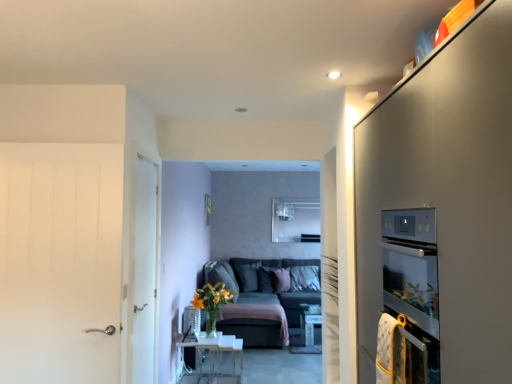
This screenshot has width=512, height=384. Find the location of `white wood door at left, marked as the first door in a back-to-front arrangement`. white wood door at left, marked as the first door in a back-to-front arrangement is located at coordinates (145, 271).

Describe the element at coordinates (259, 302) in the screenshot. This screenshot has height=384, width=512. I see `dark gray fabric couch at center` at that location.

The height and width of the screenshot is (384, 512). Describe the element at coordinates (281, 280) in the screenshot. I see `pink fabric pillow at center, the 2th pillow in the right-to-left sequence` at that location.

This screenshot has width=512, height=384. Describe the element at coordinates (248, 276) in the screenshot. I see `velvet dark gray pillow at center, which appears as the first pillow when viewed from the left` at that location.

Image resolution: width=512 pixels, height=384 pixels. What do you see at coordinates (60, 261) in the screenshot?
I see `white matte door at left, which is counted as the 2th door, starting from the back` at bounding box center [60, 261].

Measure the distance between point (480, 88) and camera.

They are 3.65 feet apart.

Find the location of a particular element. white wood door at left, marked as the first door in a back-to-front arrangement is located at coordinates (145, 271).

From the picture: From the image's perspective, which one is positioned lower, dark gray fabric couch at center or white wood door at left, marked as the first door in a back-to-front arrangement?

dark gray fabric couch at center is shown below in the image.

Image resolution: width=512 pixels, height=384 pixels. What are the coordinates of `the 1st door counting from the left side of the dark gray fabric couch at center` in the screenshot? It's located at (145, 271).

In the scene shown: Is dark gray fabric couch at center facing away from white wood door at left, the second door viewed from the front?

No.

From the image's perspective, is clear glass table at lower center above or below satin white cabinet at right?

clear glass table at lower center is situated lower than satin white cabinet at right in the image.

Is clear glass table at lower center aimed at satin white cabinet at right?

No, clear glass table at lower center is not turned towards satin white cabinet at right.

Considering the sizes of objects clear glass table at lower center and satin white cabinet at right in the image provided, who is bigger, clear glass table at lower center or satin white cabinet at right?

satin white cabinet at right is bigger.

How far apart are clear glass table at lower center and satin white cabinet at right?

clear glass table at lower center is 3.52 meters from satin white cabinet at right.

Can you confirm if white wood door at left, the first door from the right, is shorter than clear glass table at lower center?

No.

Can you confirm if white wood door at left, the second door viewed from the left, is smaller than clear glass table at lower center?

Yes, white wood door at left, the second door viewed from the left, is smaller than clear glass table at lower center.

Between white wood door at left, the second door viewed from the left, and clear glass table at lower center, which one is positioned behind?

clear glass table at lower center.

Is white wood door at left, the first door from the right, positioned beyond the bounds of clear glass table at lower center?

Yes.

The width and height of the screenshot is (512, 384). I want to click on pillow that is the 3rd one when counting downward from the white matte door at left, positioned as the second door in right-to-left order (from the image's perspective), so click(281, 280).

What's the angular difference between pink fabric pillow at center, which is the second pillow in left-to-right order, and white matte door at left, the 1th door in the left-to-right sequence,'s facing directions?

pink fabric pillow at center, which is the second pillow in left-to-right order, and white matte door at left, the 1th door in the left-to-right sequence, are facing 41.3 degrees away from each other.

Is pink fabric pillow at center, which is the second pillow in left-to-right order, looking in the opposite direction of white matte door at left, positioned as the 1th door in front-to-back order?

pink fabric pillow at center, which is the second pillow in left-to-right order, is not turned away from white matte door at left, positioned as the 1th door in front-to-back order.

Are pink fabric pillow at center, the 2th pillow in the right-to-left sequence, and white matte door at left, positioned as the 1th door in front-to-back order, located far from each other?

Yes, pink fabric pillow at center, the 2th pillow in the right-to-left sequence, and white matte door at left, positioned as the 1th door in front-to-back order, are quite far apart.

From the image's perspective, is white matte door at left, which is counted as the 2th door, starting from the back, located beneath clear glass table at lower center?

No, from the image's perspective, white matte door at left, which is counted as the 2th door, starting from the back, is not below clear glass table at lower center.

Image resolution: width=512 pixels, height=384 pixels. What are the coordinates of `table below the white matte door at left, positioned as the 1th door in front-to-back order (from the image's perspective)` in the screenshot? It's located at (215, 358).

Is white matte door at left, positioned as the 1th door in front-to-back order, inside or outside of clear glass table at lower center?

white matte door at left, positioned as the 1th door in front-to-back order, exists outside the volume of clear glass table at lower center.

In the scene shown: Is white matte door at left, which is counted as the 2th door, starting from the back, facing towards clear glass table at lower center?

No, white matte door at left, which is counted as the 2th door, starting from the back, is not facing towards clear glass table at lower center.

Is white wood door at left, the second door viewed from the left, positioned before dark gray fabric couch at center?

Yes, it is.

Is white wood door at left, the second door viewed from the front, with dark gray fabric couch at center?

No.

Where is `studio couch on the right of white wood door at left, the second door viewed from the left`? Image resolution: width=512 pixels, height=384 pixels. studio couch on the right of white wood door at left, the second door viewed from the left is located at coordinates (259, 302).

Measure the distance from pink fabric pillow at center, the 2th pillow in the right-to-left sequence, to velvet dark gray pillow at center, which appears as the first pillow when viewed from the left.

pink fabric pillow at center, the 2th pillow in the right-to-left sequence, and velvet dark gray pillow at center, which appears as the first pillow when viewed from the left, are 14.64 inches apart.

From the image's perspective, would you say pink fabric pillow at center, the 2th pillow in the right-to-left sequence, is positioned over velvet dark gray pillow at center, which appears as the first pillow when viewed from the left?

No.

Does pink fabric pillow at center, the 2th pillow in the right-to-left sequence, have a larger size compared to velvet dark gray pillow at center, which appears as the 3th pillow when viewed from the right?

Actually, pink fabric pillow at center, the 2th pillow in the right-to-left sequence, might be smaller than velvet dark gray pillow at center, which appears as the 3th pillow when viewed from the right.

Is pink fabric pillow at center, which is the second pillow in left-to-right order, inside the boundaries of velvet dark gray pillow at center, which appears as the 3th pillow when viewed from the right, or outside?

pink fabric pillow at center, which is the second pillow in left-to-right order, cannot be found inside velvet dark gray pillow at center, which appears as the 3th pillow when viewed from the right.

The image size is (512, 384). I want to click on studio couch lying on the right of white wood door at left, the second door viewed from the left, so click(259, 302).

Locate an element on the screen. This screenshot has height=384, width=512. cabinetry above the clear glass table at lower center (from a real-world perspective) is located at coordinates (447, 195).

When comparing their distances from satin white cabinet at right, does pink fabric pillow at center, which is the second pillow in left-to-right order, or white soft pillow at center, acting as the 1th pillow starting from the right, seem further?

Based on the image, pink fabric pillow at center, which is the second pillow in left-to-right order, appears to be further to satin white cabinet at right.

From the image, which object appears to be nearer to dark gray fabric couch at center, satin white cabinet at right or velvet dark gray pillow at center, which appears as the 3th pillow when viewed from the right?

Among the two, velvet dark gray pillow at center, which appears as the 3th pillow when viewed from the right, is located nearer to dark gray fabric couch at center.

Based on their spatial positions, is pink fabric pillow at center, the 2th pillow in the right-to-left sequence, or white wood door at left, marked as the first door in a back-to-front arrangement, further from satin white cabinet at right?

pink fabric pillow at center, the 2th pillow in the right-to-left sequence, is positioned further to the anchor satin white cabinet at right.

When comparing their distances from white wood door at left, the second door viewed from the front, does dark gray fabric couch at center or pink fabric pillow at center, which is the second pillow in left-to-right order, seem closer?

dark gray fabric couch at center is closer to white wood door at left, the second door viewed from the front.

From the image, which object appears to be nearer to velvet dark gray pillow at center, which appears as the 3th pillow when viewed from the right, white soft pillow at center, which ranks as the third pillow in left-to-right order, or white wood door at left, the second door viewed from the front?

Based on the image, white soft pillow at center, which ranks as the third pillow in left-to-right order, appears to be nearer to velvet dark gray pillow at center, which appears as the 3th pillow when viewed from the right.

Looking at the image, which one is located closer to white wood door at left, the second door viewed from the left, white matte door at left, the 1th door in the left-to-right sequence, or satin white cabinet at right?

Among the two, white matte door at left, the 1th door in the left-to-right sequence, is located nearer to white wood door at left, the second door viewed from the left.

Based on their spatial positions, is velvet dark gray pillow at center, which appears as the first pillow when viewed from the left, or white matte door at left, the 1th door in the left-to-right sequence, closer to satin white cabinet at right?

white matte door at left, the 1th door in the left-to-right sequence.

From the image, which object appears to be nearer to velvet dark gray pillow at center, which appears as the 3th pillow when viewed from the right, white wood door at left, the second door viewed from the left, or white matte door at left, the 1th door in the left-to-right sequence?

white wood door at left, the second door viewed from the left, is positioned closer to the anchor velvet dark gray pillow at center, which appears as the 3th pillow when viewed from the right.

Where is `table between satin white cabinet at right and white soft pillow at center, acting as the 1th pillow starting from the right, along the z-axis`? table between satin white cabinet at right and white soft pillow at center, acting as the 1th pillow starting from the right, along the z-axis is located at coordinates point(215,358).

Where is `studio couch between satin white cabinet at right and velvet dark gray pillow at center, which appears as the first pillow when viewed from the left, along the z-axis`? studio couch between satin white cabinet at right and velvet dark gray pillow at center, which appears as the first pillow when viewed from the left, along the z-axis is located at coordinates (259, 302).

The width and height of the screenshot is (512, 384). What are the coordinates of `table located between white matte door at left, positioned as the second door in right-to-left order, and pink fabric pillow at center, the 2th pillow in the right-to-left sequence, in the depth direction` in the screenshot? It's located at (215, 358).

This screenshot has height=384, width=512. What are the coordinates of `table between satin white cabinet at right and pink fabric pillow at center, the 2th pillow in the right-to-left sequence, from front to back` in the screenshot? It's located at (215, 358).